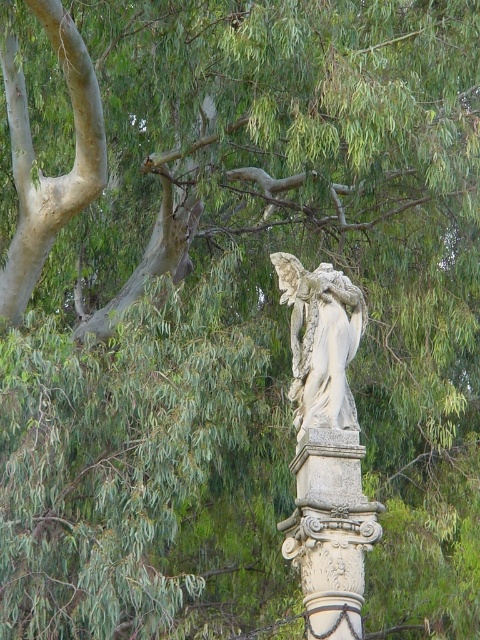
Question: Can you confirm if carved stone column at center is positioned above white stone angel at center?

Choices:
 (A) no
 (B) yes

Answer: (A)

Question: Which of the following is the farthest from the observer?

Choices:
 (A) white stone angel at center
 (B) carved stone column at center

Answer: (A)

Question: Observing the image, what is the correct spatial positioning of carved stone column at center in reference to white stone angel at center?

Choices:
 (A) left
 (B) right

Answer: (A)

Question: Which point is closer to the camera?

Choices:
 (A) white stone angel at center
 (B) carved stone column at center

Answer: (B)

Question: Among these points, which one is nearest to the camera?

Choices:
 (A) pos(305,380)
 (B) pos(334,628)

Answer: (B)

Question: Does carved stone column at center have a larger size compared to white stone angel at center?

Choices:
 (A) yes
 (B) no

Answer: (B)